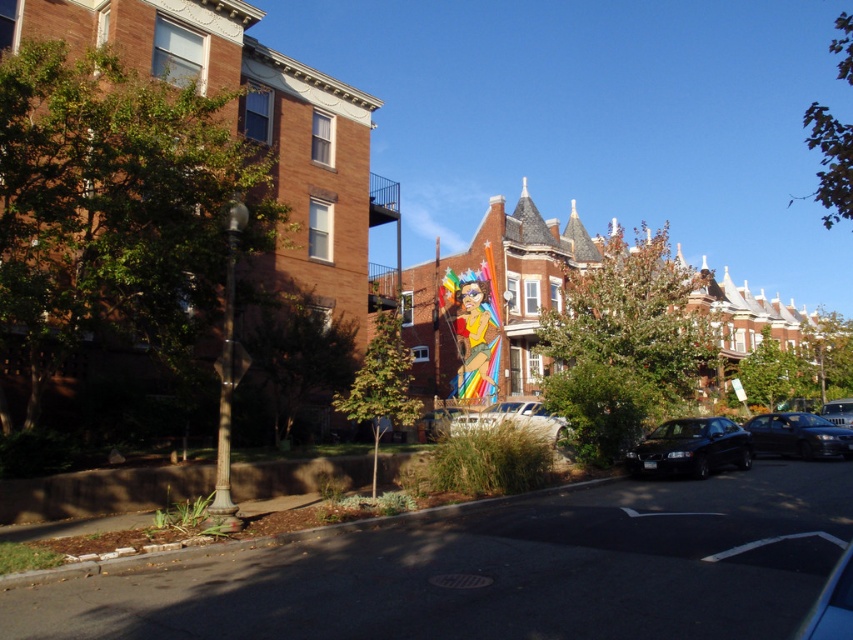
Based on the photo, you are a pedestrian standing on the sidewalk and want to cross the street to reach the grassy area. There are two parked cars blocking your path. Which car should you move first to get a clear path? The black glossy sedan at lower right or the shiny black sedan at center right?

You should move the black glossy sedan at lower right first because it is in front of the shiny black sedan at center right, so moving it would allow access to the other car and clear the path.

You are a delivery person who needs to park your vehicle between the shiny black sedan at center right and the metallic silver car at center. Based on the scene, which car should you position your vehicle closer to if you want to maximize the available space for parking?

You should position your vehicle closer to the shiny black sedan at center right because it has a smaller size compared to the metallic silver car at center, allowing more space between them.

You are a pedestrian standing on the sidewalk next to the lamppost. You want to cross the street to reach a bus stop located behind the parked cars. The distance between the black glossy sedan at lower right and the metallic silver car at right is crucial for determining if there is enough space to safely walk between them. Is there sufficient space for you to pass through the gap between these two cars?

The black glossy sedan at lower right is 11.87 meters away from the metallic silver car at right. Since the distance between them is quite large, there should be enough space for a pedestrian to safely walk through the gap between the black glossy sedan at lower right and the metallic silver car at right.